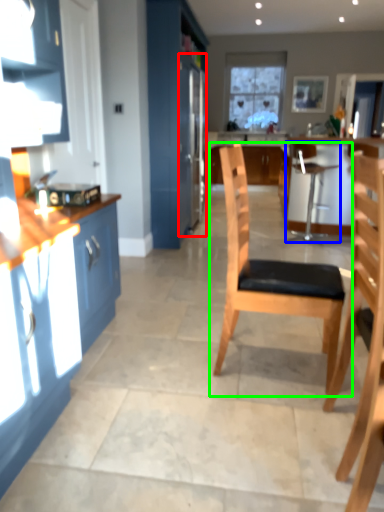
Question: Which object is positioned farthest from refrigerator (highlighted by a red box)? Select from chair (highlighted by a blue box) and chair (highlighted by a green box).

Choices:
 (A) chair
 (B) chair

Answer: (B)